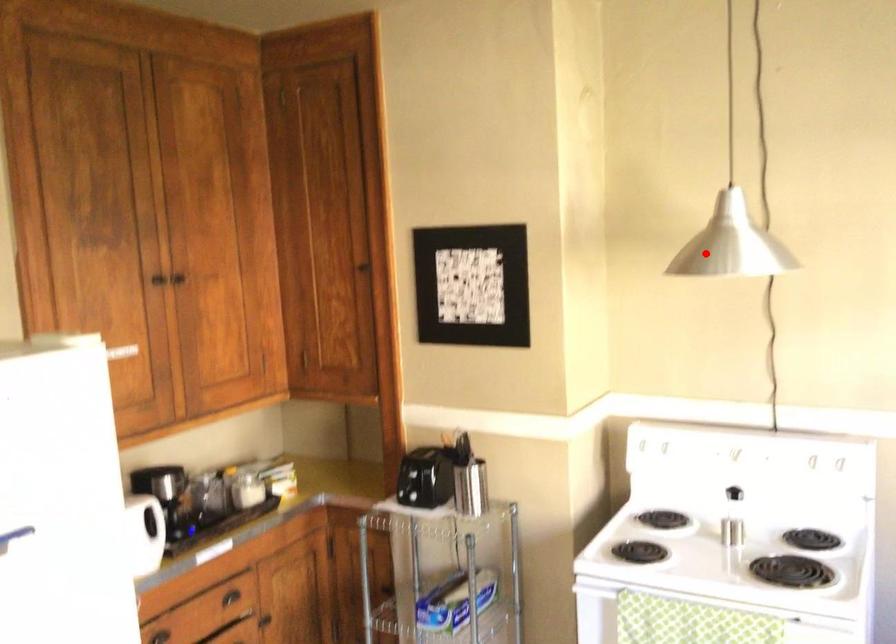
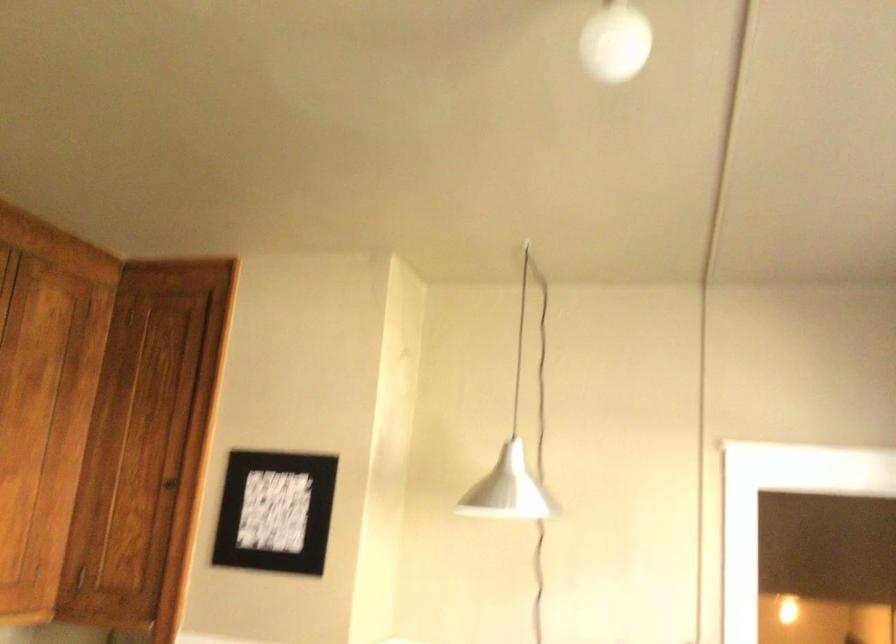
Question: I am providing you with two images of the same scene from different viewpoints. Image1 has a red point marked. In image2, the corresponding 3D location appears at what relative position? Reply with the corresponding letter.

Choices:
 (A) Closer
 (B) Farther

Answer: (B)